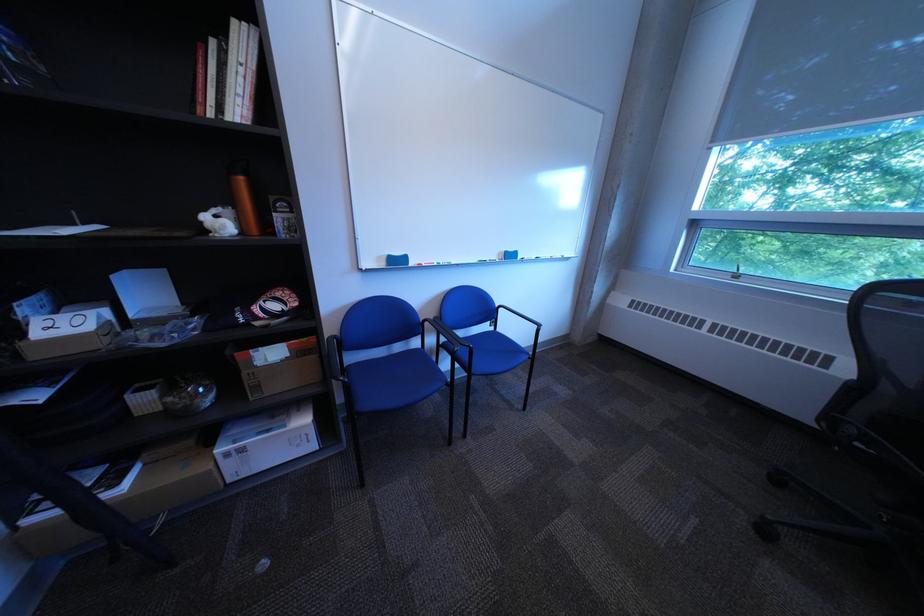
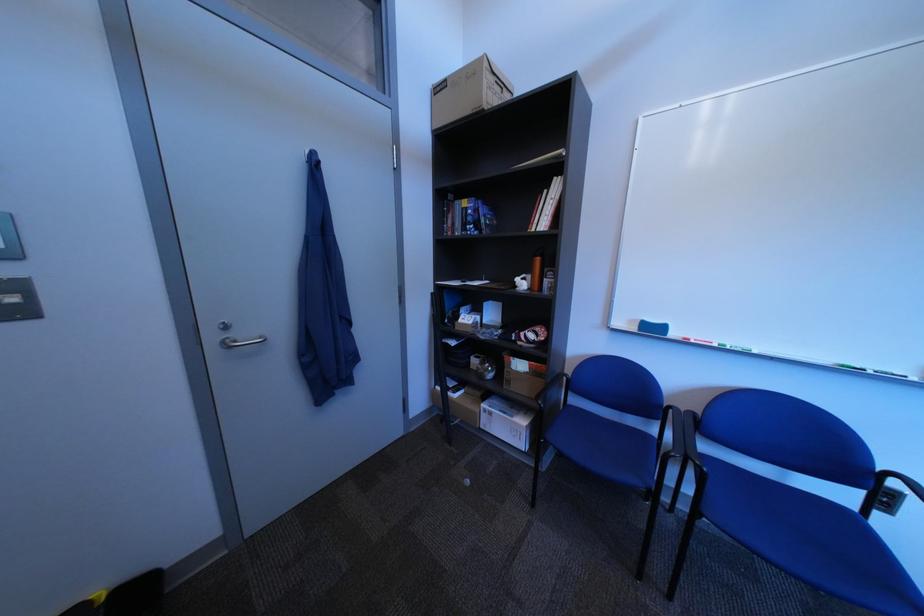
Where in the second image is the point corresponding to point (394, 260) from the first image?

(647, 323)